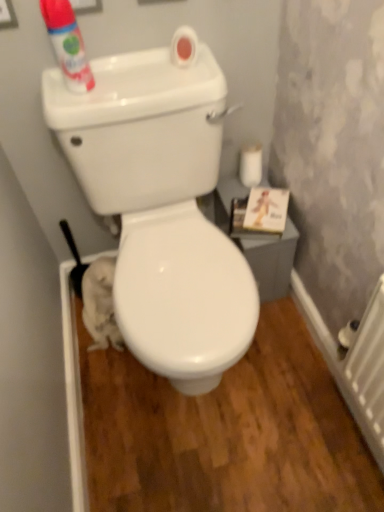
Question: Does matte white can at upper left have a lesser width compared to white glossy toilet at center?

Choices:
 (A) yes
 (B) no

Answer: (A)

Question: Considering the relative sizes of matte white can at upper left and white glossy toilet at center in the image provided, is matte white can at upper left shorter than white glossy toilet at center?

Choices:
 (A) yes
 (B) no

Answer: (A)

Question: Would you say matte white can at upper left is a long distance from white glossy toilet at center?

Choices:
 (A) yes
 (B) no

Answer: (B)

Question: Is white glossy toilet at center a part of matte white can at upper left?

Choices:
 (A) yes
 (B) no

Answer: (B)

Question: Considering the relative positions of matte white can at upper left and white glossy toilet at center in the image provided, is matte white can at upper left in front of white glossy toilet at center?

Choices:
 (A) no
 (B) yes

Answer: (A)

Question: Can you confirm if matte white can at upper left is wider than white glossy toilet at center?

Choices:
 (A) yes
 (B) no

Answer: (B)

Question: From the image's perspective, is matte white can at upper left below white matte toilet paper at right?

Choices:
 (A) no
 (B) yes

Answer: (A)

Question: Does matte white can at upper left have a smaller size compared to white matte toilet paper at right?

Choices:
 (A) yes
 (B) no

Answer: (B)

Question: Is matte white can at upper left at the left side of white matte toilet paper at right?

Choices:
 (A) no
 (B) yes

Answer: (B)

Question: From a real-world perspective, is matte white can at upper left located beneath white matte toilet paper at right?

Choices:
 (A) no
 (B) yes

Answer: (A)

Question: Is matte white can at upper left closer to the viewer compared to white matte toilet paper at right?

Choices:
 (A) no
 (B) yes

Answer: (B)

Question: Are matte white can at upper left and white matte toilet paper at right located far from each other?

Choices:
 (A) no
 (B) yes

Answer: (A)

Question: Is white matte toilet paper at right completely or partially outside of matte white can at upper left?

Choices:
 (A) yes
 (B) no

Answer: (A)